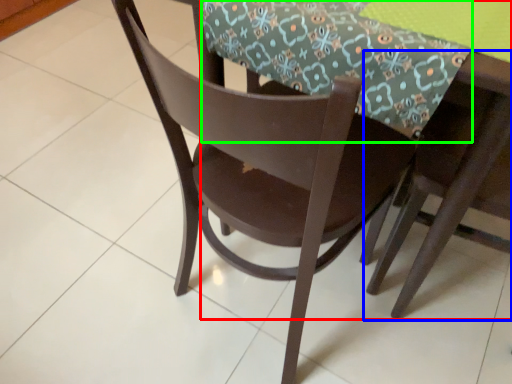
Question: Estimate the real-world distances between objects in this image. Which object is farther from round table (highlighted by a red box), chair (highlighted by a blue box) or tablecloth (highlighted by a green box)?

Choices:
 (A) chair
 (B) tablecloth

Answer: (B)